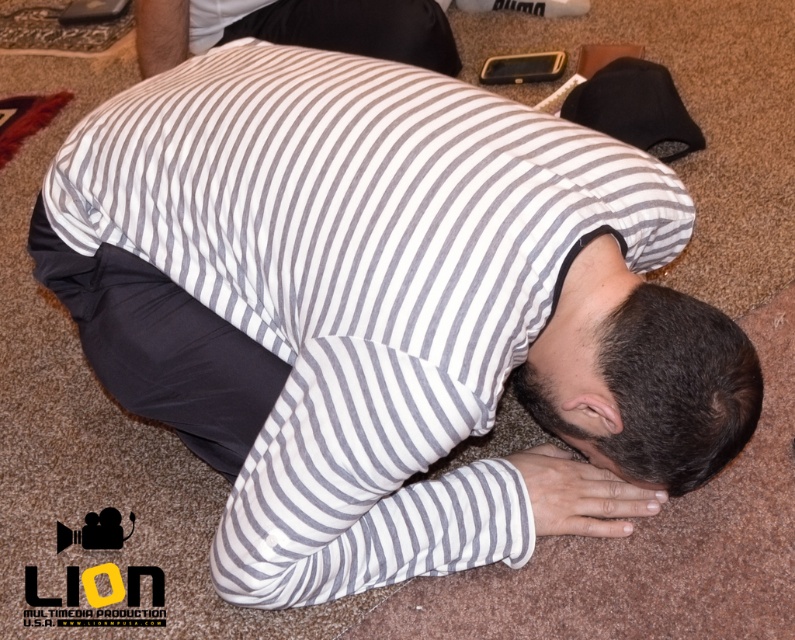
Question: Is gray striped shirt at center to the left of dark brown hair at center from the viewer's perspective?

Choices:
 (A) yes
 (B) no

Answer: (A)

Question: Which point is closer to the camera?

Choices:
 (A) dark brown hair at center
 (B) gray striped shirt at center
 (C) white striped pillow at center

Answer: (B)

Question: In this image, where is gray striped shirt at center located relative to white striped pillow at center?

Choices:
 (A) right
 (B) left

Answer: (A)

Question: Among these objects, which one is farthest from the camera?

Choices:
 (A) gray striped shirt at center
 (B) white striped pillow at center

Answer: (B)

Question: Among these points, which one is farthest from the camera?

Choices:
 (A) (367, 54)
 (B) (493, 484)

Answer: (A)

Question: Can you confirm if gray striped shirt at center is positioned below dark brown hair at center?

Choices:
 (A) no
 (B) yes

Answer: (A)